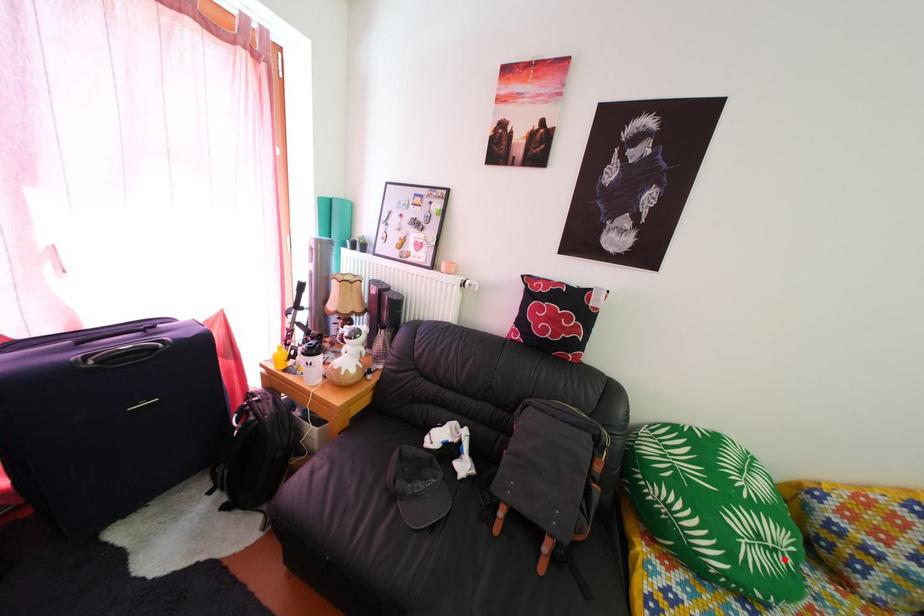
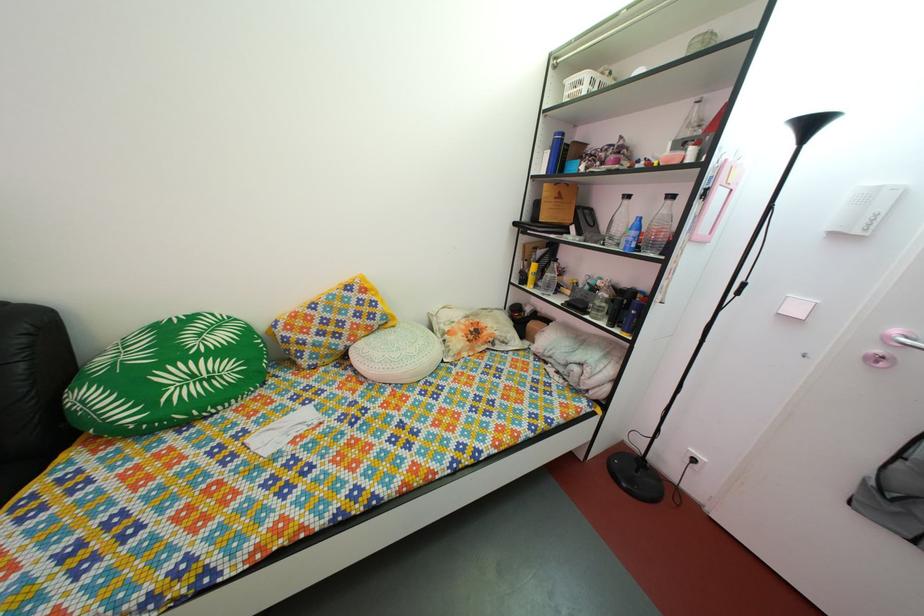
Locate, in the second image, the point that corresponds to the highlighted location in the first image.

(220, 387)